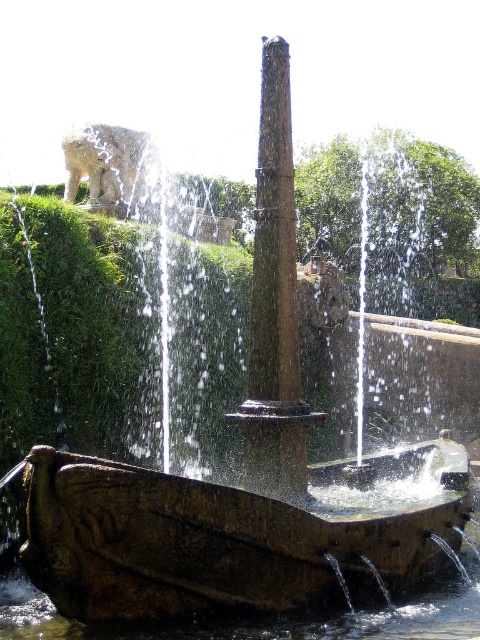
Looking at this image, which of these two, rusty stone boat at center or brown stone pillar at center, stands shorter?

rusty stone boat at center is shorter.

Is rusty stone boat at center smaller than brown stone pillar at center?

Incorrect, rusty stone boat at center is not smaller in size than brown stone pillar at center.

Locate an element on the screen. rusty stone boat at center is located at coordinates pyautogui.click(x=220, y=540).

In order to click on rusty stone boat at center in this screenshot , I will do `click(220, 540)`.